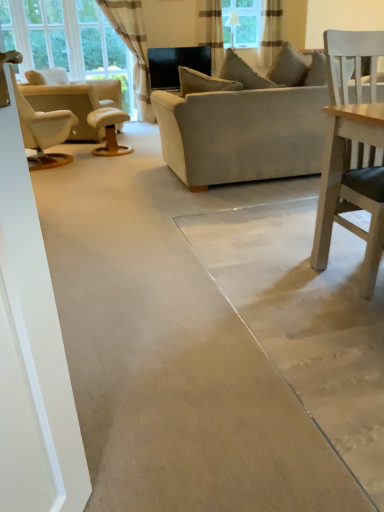
Question: From a real-world perspective, is wooden stool at center positioned over white leather recliner at left based on gravity?

Choices:
 (A) no
 (B) yes

Answer: (A)

Question: Considering the relative positions of wooden stool at center and white leather recliner at left in the image provided, is wooden stool at center to the left of white leather recliner at left from the viewer's perspective?

Choices:
 (A) yes
 (B) no

Answer: (B)

Question: Is wooden stool at center wider than white leather recliner at left?

Choices:
 (A) no
 (B) yes

Answer: (A)

Question: From a real-world perspective, is wooden stool at center below white leather recliner at left?

Choices:
 (A) yes
 (B) no

Answer: (A)

Question: Could you tell me if wooden stool at center is facing white leather recliner at left?

Choices:
 (A) no
 (B) yes

Answer: (A)

Question: Is point 208,101 positioned closer to the camera than point 278,30?

Choices:
 (A) closer
 (B) farther

Answer: (A)

Question: Is suede gray couch at center in front of or behind striped fabric curtain at upper center, marked as the first curtain in a right-to-left arrangement, in the image?

Choices:
 (A) front
 (B) behind

Answer: (A)

Question: In the image, is suede gray couch at center on the left side or the right side of striped fabric curtain at upper center, marked as the 3th curtain in a left-to-right arrangement?

Choices:
 (A) right
 (B) left

Answer: (B)

Question: Is suede gray couch at center inside the boundaries of striped fabric curtain at upper center, marked as the first curtain in a right-to-left arrangement, or outside?

Choices:
 (A) outside
 (B) inside

Answer: (A)

Question: Relative to white striped curtain at upper left, placed as the third curtain when sorted from right to left, is wooden stool at center in front or behind?

Choices:
 (A) behind
 (B) front

Answer: (B)

Question: Does point (99, 111) appear closer or farther from the camera than point (119, 8)?

Choices:
 (A) farther
 (B) closer

Answer: (B)

Question: Would you say wooden stool at center is inside or outside white striped curtain at upper left, placed as the first curtain when sorted from left to right?

Choices:
 (A) inside
 (B) outside

Answer: (B)

Question: From a real-world perspective, is wooden stool at center positioned above or below white striped curtain at upper left, placed as the third curtain when sorted from right to left?

Choices:
 (A) below
 (B) above

Answer: (A)

Question: Is wooden stool at center wider or thinner than suede gray couch at center?

Choices:
 (A) wide
 (B) thin

Answer: (B)

Question: Based on their sizes in the image, would you say wooden stool at center is bigger or smaller than suede gray couch at center?

Choices:
 (A) big
 (B) small

Answer: (B)